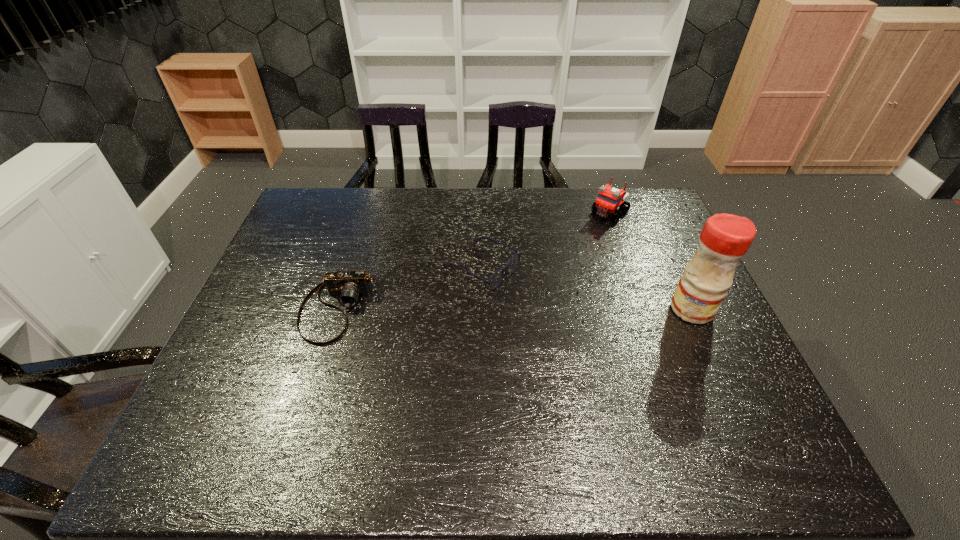
Image resolution: width=960 pixels, height=540 pixels. What are the coordinates of `camera` in the screenshot? It's located at (348, 286).

Identify the location of condiment. This screenshot has height=540, width=960. (725, 238).

This screenshot has height=540, width=960. Find the location of `the rightmost object`. the rightmost object is located at coordinates (725, 238).

At what (x,y) coordinates should I click in order to perform the action: click on the third shortest object. Please return your answer as a coordinate pair (x, y). The height and width of the screenshot is (540, 960). Looking at the image, I should click on (609, 199).

At what (x,y) coordinates should I click in order to perform the action: click on Lego. Please return your answer as a coordinate pair (x, y). The image size is (960, 540). Looking at the image, I should click on tap(609, 199).

Where is `spectacles`? The image size is (960, 540). spectacles is located at coordinates (495, 280).

In order to click on the second object from left to right in this screenshot , I will do `click(495, 280)`.

The image size is (960, 540). Identify the location of vacant space located 0.090m on the front-facing side of the camera. (316, 376).

Where is `vacant region located on the front of the tallest object`? Image resolution: width=960 pixels, height=540 pixels. vacant region located on the front of the tallest object is located at coordinates (708, 345).

The height and width of the screenshot is (540, 960). Find the location of `free spot located on the front-facing side of the farthest object`. free spot located on the front-facing side of the farthest object is located at coordinates (585, 235).